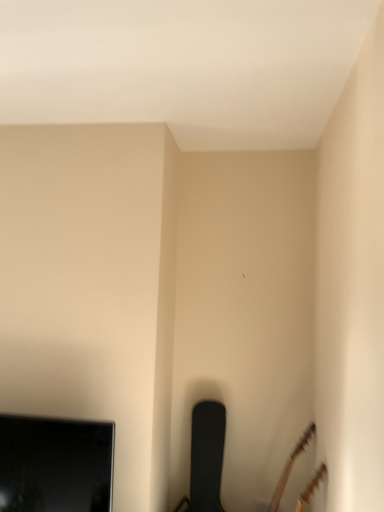
Question: Is black textured chair at lower center surrounded by brown matte guitar at lower right?

Choices:
 (A) yes
 (B) no

Answer: (B)

Question: Can you confirm if brown matte guitar at lower right is taller than black textured chair at lower center?

Choices:
 (A) no
 (B) yes

Answer: (A)

Question: Does brown matte guitar at lower right have a greater width compared to black textured chair at lower center?

Choices:
 (A) yes
 (B) no

Answer: (A)

Question: Is brown matte guitar at lower right not within black textured chair at lower center?

Choices:
 (A) yes
 (B) no

Answer: (A)

Question: Does brown matte guitar at lower right come in front of black textured chair at lower center?

Choices:
 (A) yes
 (B) no

Answer: (A)

Question: In terms of height, does black textured chair at lower center look taller or shorter compared to brown matte guitar at lower right?

Choices:
 (A) tall
 (B) short

Answer: (A)

Question: Is black textured chair at lower center to the left or to the right of brown matte guitar at lower right in the image?

Choices:
 (A) left
 (B) right

Answer: (A)

Question: From a real-world perspective, is black textured chair at lower center above or below brown matte guitar at lower right?

Choices:
 (A) above
 (B) below

Answer: (B)

Question: Do you think black textured chair at lower center is within brown matte guitar at lower right, or outside of it?

Choices:
 (A) outside
 (B) inside

Answer: (A)

Question: Is black glossy television at lower left wider or thinner than brown matte guitar at lower right?

Choices:
 (A) wide
 (B) thin

Answer: (B)

Question: From the image's perspective, relative to brown matte guitar at lower right, is black glossy television at lower left above or below?

Choices:
 (A) above
 (B) below

Answer: (A)

Question: From a real-world perspective, is black glossy television at lower left positioned above or below brown matte guitar at lower right?

Choices:
 (A) above
 (B) below

Answer: (A)

Question: Is point (64, 421) closer or farther from the camera than point (269, 501)?

Choices:
 (A) farther
 (B) closer

Answer: (B)

Question: In terms of height, does black glossy television at lower left look taller or shorter compared to black textured chair at lower center?

Choices:
 (A) short
 (B) tall

Answer: (A)

Question: In terms of size, does black glossy television at lower left appear bigger or smaller than black textured chair at lower center?

Choices:
 (A) small
 (B) big

Answer: (A)